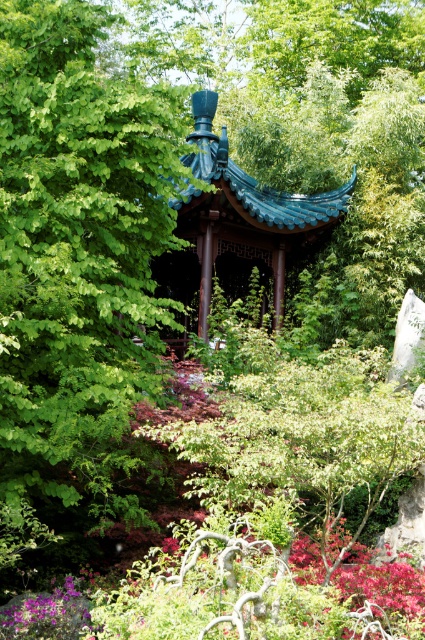
Can you confirm if green glossy tree at center is positioned to the left of matte purple flower at center?

Correct, you'll find green glossy tree at center to the left of matte purple flower at center.

Does green glossy tree at center come in front of matte purple flower at center?

No, green glossy tree at center is further to the viewer.

Measure the distance between point (x=11, y=390) and camera.

They are 8.90 meters apart.

You are a GUI agent. You are given a task and a screenshot of the screen. Output one action in this format:
    pyautogui.click(x=<x>, y=<y>)
    Task: Click on the green glossy tree at center
    The width and height of the screenshot is (425, 640).
    Given the screenshot: What is the action you would take?
    pyautogui.click(x=76, y=268)

Who is taller, matte purple flower at center or teal glazed gazebo at center?

teal glazed gazebo at center

Is matte purple flower at center positioned at the back of teal glazed gazebo at center?

No, it is not.

What do you see at coordinates (229, 595) in the screenshot? I see `matte purple flower at center` at bounding box center [229, 595].

Where is `matte purple flower at center`? Image resolution: width=425 pixels, height=640 pixels. matte purple flower at center is located at coordinates (229, 595).

This screenshot has height=640, width=425. I want to click on green glossy tree at center, so click(x=76, y=268).

Does green glossy tree at center lie in front of teal glazed gazebo at center?

Yes, it is.

Is point (31, 296) positioned after point (195, 269)?

No, it is in front of (195, 269).

The image size is (425, 640). I want to click on green glossy tree at center, so click(x=76, y=268).